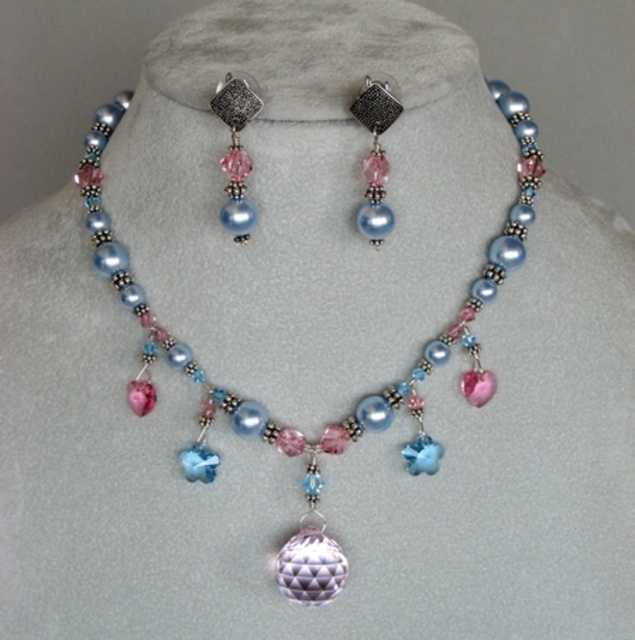
You are an appraiser examining the jewelry set displayed on the mannequin bust. You notice a point marked at coordinates (236, 152). Based on the jewelry set described, what does this point most likely represent?

The point at coordinates (236, 152) corresponds to the pearl like pendant at upper center.